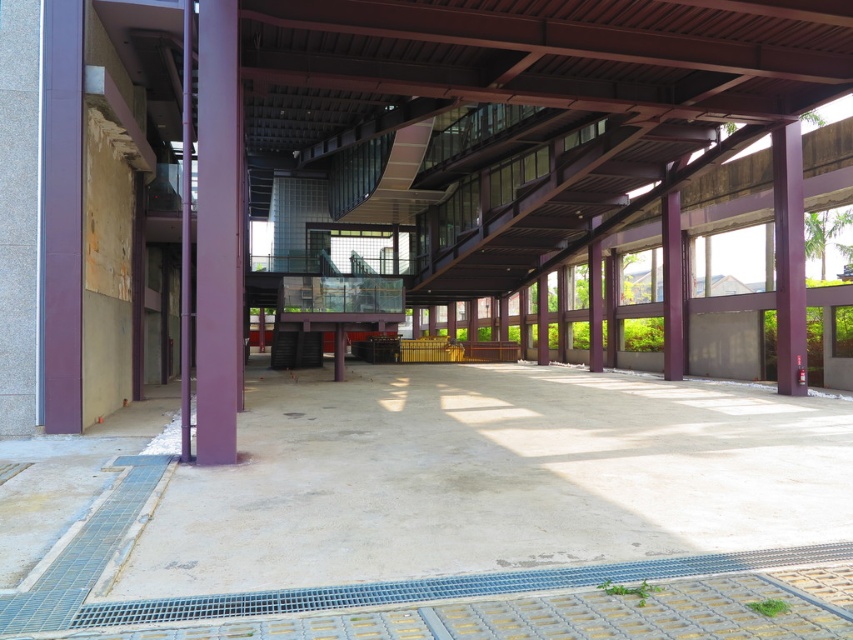
Can you confirm if purple matte/finish pillar at left is positioned above gray concrete grate at lower center?

Correct, purple matte/finish pillar at left is located above gray concrete grate at lower center.

Consider the image. Between purple matte/finish pillar at left and gray concrete grate at lower center, which one has more height?

Standing taller between the two is purple matte/finish pillar at left.

Does point (213, 358) come closer to viewer compared to point (323, 588)?

No.

The image size is (853, 640). What are the coordinates of `purple matte/finish pillar at left` in the screenshot? It's located at (218, 234).

Can you confirm if purple matte/finish pillar at left is positioned below purple matte/wooden pillar at center?

Yes, purple matte/finish pillar at left is below purple matte/wooden pillar at center.

Is purple matte/finish pillar at left to the right of purple matte/wooden pillar at center from the viewer's perspective?

In fact, purple matte/finish pillar at left is to the left of purple matte/wooden pillar at center.

Where is `purple matte/finish pillar at left`? The height and width of the screenshot is (640, 853). purple matte/finish pillar at left is located at coordinates (218, 234).

Where is `purple matte/finish pillar at left`? This screenshot has height=640, width=853. purple matte/finish pillar at left is located at coordinates (218, 234).

Can you confirm if purple matte/finish pillar at center is wider than purple matte/wooden pillar at center?

No.

Between purple matte/finish pillar at center and purple matte/wooden pillar at center, which one is positioned lower?

Positioned lower is purple matte/finish pillar at center.

Which is behind, point (598, 253) or point (544, 317)?

The point (544, 317) is behind.

The image size is (853, 640). I want to click on purple matte/finish pillar at center, so click(x=595, y=305).